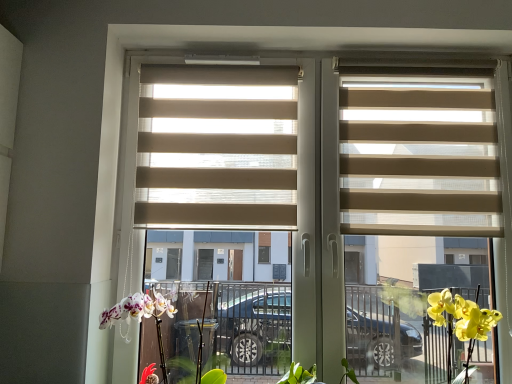
Describe the element at coordinates (217, 147) in the screenshot. This screenshot has height=384, width=512. I see `beige fabric blinds at center, the 1th window blind viewed from the left` at that location.

This screenshot has width=512, height=384. Describe the element at coordinates (419, 162) in the screenshot. I see `beige fabric blinds at right, placed as the second window blind when sorted from left to right` at that location.

The height and width of the screenshot is (384, 512). What do you see at coordinates (227, 165) in the screenshot? I see `beige fabric blinds at center` at bounding box center [227, 165].

Locate an element on the screen. This screenshot has height=384, width=512. beige fabric blinds at center is located at coordinates (227, 165).

The height and width of the screenshot is (384, 512). What are the coordinates of `beige fabric blinds at center, the 1th window blind viewed from the left` in the screenshot? It's located at 217,147.

Considering the positions of point (277, 153) and point (178, 375), is point (277, 153) closer or farther from the camera than point (178, 375)?

Point (277, 153) is closer to the camera than point (178, 375).

From a real-world perspective, which is physically above, beige fabric blinds at center, the 2th window blind from the right, or white matte orchid at lower left?

In real-world perspective, beige fabric blinds at center, the 2th window blind from the right, is above.

From the image's perspective, which is below, beige fabric blinds at center, the 2th window blind from the right, or white matte orchid at lower left?

From the image's view, white matte orchid at lower left is below.

Does beige fabric blinds at center, the 2th window blind from the right, lie in front of white matte orchid at lower left?

No, the depth of beige fabric blinds at center, the 2th window blind from the right, is greater than that of white matte orchid at lower left.

From the image's perspective, which object appears higher, beige fabric blinds at center or beige fabric blinds at right, marked as the first window blind in a right-to-left arrangement?

beige fabric blinds at right, marked as the first window blind in a right-to-left arrangement, appears higher in the image.

Is beige fabric blinds at center behind beige fabric blinds at right, placed as the second window blind when sorted from left to right?

No.

Which is more to the right, beige fabric blinds at center or beige fabric blinds at right, placed as the second window blind when sorted from left to right?

Positioned to the right is beige fabric blinds at right, placed as the second window blind when sorted from left to right.

Can you confirm if beige fabric blinds at center, the 2th window blind from the right, is smaller than beige fabric blinds at center?

Yes.

Consider the image. Do you think beige fabric blinds at center, the 1th window blind viewed from the left, is within beige fabric blinds at center, or outside of it?

beige fabric blinds at center, the 1th window blind viewed from the left, is enclosed within beige fabric blinds at center.

From a real-world perspective, is beige fabric blinds at center, the 1th window blind viewed from the left, physically below beige fabric blinds at center?

No, from a real-world perspective, beige fabric blinds at center, the 1th window blind viewed from the left, is not below beige fabric blinds at center.

Who is shorter, beige fabric blinds at center, the 1th window blind viewed from the left, or beige fabric blinds at center?

beige fabric blinds at center, the 1th window blind viewed from the left, is shorter.

From the image's perspective, is beige fabric blinds at right, placed as the second window blind when sorted from left to right, above or below beige fabric blinds at center?

beige fabric blinds at right, placed as the second window blind when sorted from left to right, is above beige fabric blinds at center.

How far apart are beige fabric blinds at right, marked as the first window blind in a right-to-left arrangement, and beige fabric blinds at center?

beige fabric blinds at right, marked as the first window blind in a right-to-left arrangement, and beige fabric blinds at center are 4.22 inches apart from each other.

This screenshot has width=512, height=384. I want to click on the 1st window blind directly above the beige fabric blinds at center (from a real-world perspective), so coord(419,162).

Can you confirm if beige fabric blinds at right, marked as the first window blind in a right-to-left arrangement, is wider than beige fabric blinds at center?

In fact, beige fabric blinds at right, marked as the first window blind in a right-to-left arrangement, might be narrower than beige fabric blinds at center.

Find the location of a particular element. Image resolution: width=512 pixels, height=384 pixels. window above the white matte orchid at lower left (from a real-world perspective) is located at coordinates (227, 165).

How many degrees apart are the facing directions of beige fabric blinds at center and white matte orchid at lower left?

The angular difference between beige fabric blinds at center and white matte orchid at lower left is 1.04 degrees.

Considering the relative positions of beige fabric blinds at center and white matte orchid at lower left in the image provided, is beige fabric blinds at center to the right of white matte orchid at lower left from the viewer's perspective?

Indeed, beige fabric blinds at center is positioned on the right side of white matte orchid at lower left.

Looking at this image, would you say beige fabric blinds at center contains white matte orchid at lower left?

Definitely not — white matte orchid at lower left is not inside beige fabric blinds at center.

Consider the image. Considering the positions of objects white matte orchid at lower left and beige fabric blinds at right, marked as the first window blind in a right-to-left arrangement, in the image provided, who is more to the left, white matte orchid at lower left or beige fabric blinds at right, marked as the first window blind in a right-to-left arrangement,?

From the viewer's perspective, white matte orchid at lower left appears more on the left side.

Who is taller, white matte orchid at lower left or beige fabric blinds at right, marked as the first window blind in a right-to-left arrangement?

beige fabric blinds at right, marked as the first window blind in a right-to-left arrangement, is taller.

Is white matte orchid at lower left oriented away from beige fabric blinds at right, placed as the second window blind when sorted from left to right?

white matte orchid at lower left is not turned away from beige fabric blinds at right, placed as the second window blind when sorted from left to right.

Can you confirm if white matte orchid at lower left is wider than beige fabric blinds at right, placed as the second window blind when sorted from left to right?

Indeed, white matte orchid at lower left has a greater width compared to beige fabric blinds at right, placed as the second window blind when sorted from left to right.

Could you measure the distance between beige fabric blinds at center and beige fabric blinds at center, the 2th window blind from the right?

4.08 inches.

Where is `window below the beige fabric blinds at center, the 1th window blind viewed from the left (from the image's perspective)`? The height and width of the screenshot is (384, 512). window below the beige fabric blinds at center, the 1th window blind viewed from the left (from the image's perspective) is located at coordinates pos(227,165).

Considering the relative sizes of beige fabric blinds at center and beige fabric blinds at center, the 2th window blind from the right, in the image provided, is beige fabric blinds at center smaller than beige fabric blinds at center, the 2th window blind from the right,?

Incorrect, beige fabric blinds at center is not smaller in size than beige fabric blinds at center, the 2th window blind from the right.

Between beige fabric blinds at center and beige fabric blinds at center, the 2th window blind from the right, which one has more height?

With more height is beige fabric blinds at center.

You are a GUI agent. You are given a task and a screenshot of the screen. Output one action in this format:
    pyautogui.click(x=<x>, y=<y>)
    Task: Click on the plant in front of the beige fabric blinds at center, the 2th window blind from the right
    
    Given the screenshot: What is the action you would take?
    pyautogui.click(x=183, y=336)

Identify the location of window blind that is the 1st one above the beige fabric blinds at center (from a real-world perspective). The image size is (512, 384). (419, 162).

Based on their spatial positions, is beige fabric blinds at right, marked as the first window blind in a right-to-left arrangement, or beige fabric blinds at center closer to beige fabric blinds at center, the 1th window blind viewed from the left?

Based on the image, beige fabric blinds at center appears to be nearer to beige fabric blinds at center, the 1th window blind viewed from the left.

Which object lies nearer to the anchor point beige fabric blinds at center, beige fabric blinds at center, the 1th window blind viewed from the left, or white matte orchid at lower left?

Among the two, beige fabric blinds at center, the 1th window blind viewed from the left, is located nearer to beige fabric blinds at center.

Which object lies nearer to the anchor point white matte orchid at lower left, beige fabric blinds at center, the 1th window blind viewed from the left, or beige fabric blinds at right, placed as the second window blind when sorted from left to right?

The object closer to white matte orchid at lower left is beige fabric blinds at center, the 1th window blind viewed from the left.

Looking at the image, which one is located closer to beige fabric blinds at center, white matte orchid at lower left or beige fabric blinds at center, the 2th window blind from the right?

Among the two, beige fabric blinds at center, the 2th window blind from the right, is located nearer to beige fabric blinds at center.

When comparing their distances from beige fabric blinds at center, does beige fabric blinds at center, the 2th window blind from the right, or beige fabric blinds at right, placed as the second window blind when sorted from left to right, seem closer?

Among the two, beige fabric blinds at center, the 2th window blind from the right, is located nearer to beige fabric blinds at center.

Based on their spatial positions, is beige fabric blinds at center or beige fabric blinds at center, the 2th window blind from the right, closer to beige fabric blinds at right, placed as the second window blind when sorted from left to right?

beige fabric blinds at center lies closer to beige fabric blinds at right, placed as the second window blind when sorted from left to right, than the other object.

Estimate the real-world distances between objects in this image. Which object is closer to beige fabric blinds at right, marked as the first window blind in a right-to-left arrangement, beige fabric blinds at center or white matte orchid at lower left?

Based on the image, beige fabric blinds at center appears to be nearer to beige fabric blinds at right, marked as the first window blind in a right-to-left arrangement.

In the scene shown: Considering their positions, is beige fabric blinds at right, placed as the second window blind when sorted from left to right, positioned further to beige fabric blinds at center, the 2th window blind from the right, than white matte orchid at lower left?

white matte orchid at lower left lies further to beige fabric blinds at center, the 2th window blind from the right, than the other object.

Image resolution: width=512 pixels, height=384 pixels. Identify the location of window between beige fabric blinds at center, the 1th window blind viewed from the left, and white matte orchid at lower left vertically. (227, 165).

Where is `window between white matte orchid at lower left and beige fabric blinds at right, marked as the first window blind in a right-to-left arrangement`? window between white matte orchid at lower left and beige fabric blinds at right, marked as the first window blind in a right-to-left arrangement is located at coordinates (227, 165).

This screenshot has width=512, height=384. In order to click on window between beige fabric blinds at center, the 2th window blind from the right, and beige fabric blinds at right, marked as the first window blind in a right-to-left arrangement in this screenshot , I will do `click(227, 165)`.

You are a GUI agent. You are given a task and a screenshot of the screen. Output one action in this format:
    pyautogui.click(x=<x>, y=<y>)
    Task: Click on the window blind between white matte orchid at lower left and beige fabric blinds at right, placed as the second window blind when sorted from left to right, in the horizontal direction
    This screenshot has width=512, height=384.
    Given the screenshot: What is the action you would take?
    pyautogui.click(x=217, y=147)